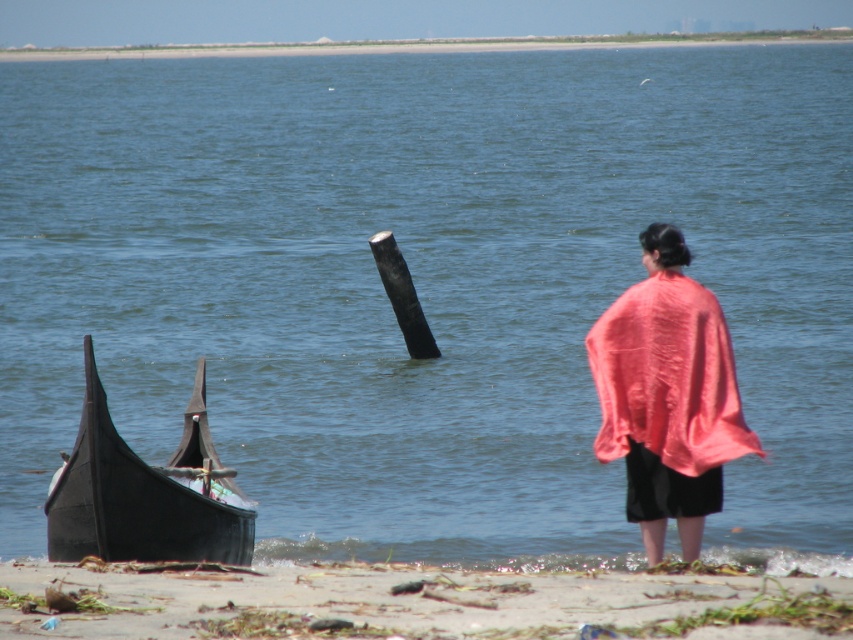
Question: Considering the relative positions of pink fabric at right and black polished wood boat at lower left in the image provided, where is pink fabric at right located with respect to black polished wood boat at lower left?

Choices:
 (A) right
 (B) left

Answer: (A)

Question: Which object appears closest to the camera in this image?

Choices:
 (A) pink fabric at right
 (B) black polished wood boat at lower left
 (C) sandy beach at lower left

Answer: (C)

Question: Among these objects, which one is farthest from the camera?

Choices:
 (A) black polished wood boat at lower left
 (B) sandy beach at lower left
 (C) pink fabric at right

Answer: (C)

Question: Observing the image, what is the correct spatial positioning of pink fabric at right in reference to black polished wood boat at lower left?

Choices:
 (A) right
 (B) left

Answer: (A)

Question: Which of these objects is positioned closest to the black polished wood boat at lower left?

Choices:
 (A) pink fabric at right
 (B) sandy beach at lower left

Answer: (B)

Question: Is pink fabric at right smaller than black polished wood boat at lower left?

Choices:
 (A) yes
 (B) no

Answer: (A)